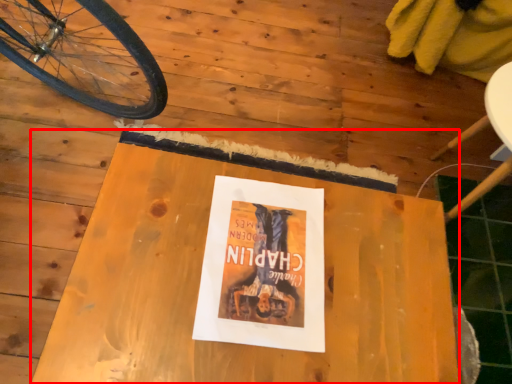
Question: From the image's perspective, what is the correct spatial relationship of table (annotated by the red box) in relation to paperback book?

Choices:
 (A) below
 (B) above

Answer: (A)